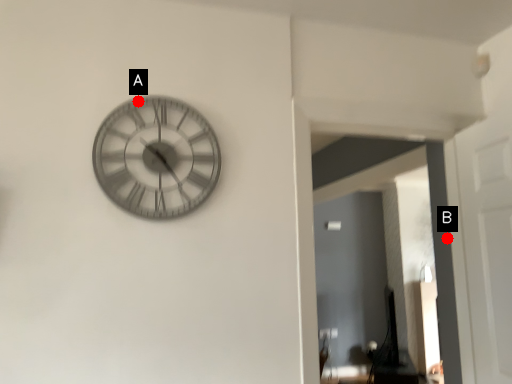
Question: Two points are circled on the image, labeled by A and B beside each circle. Which point is closer to the camera?

Choices:
 (A) A is closer
 (B) B is closer

Answer: (A)